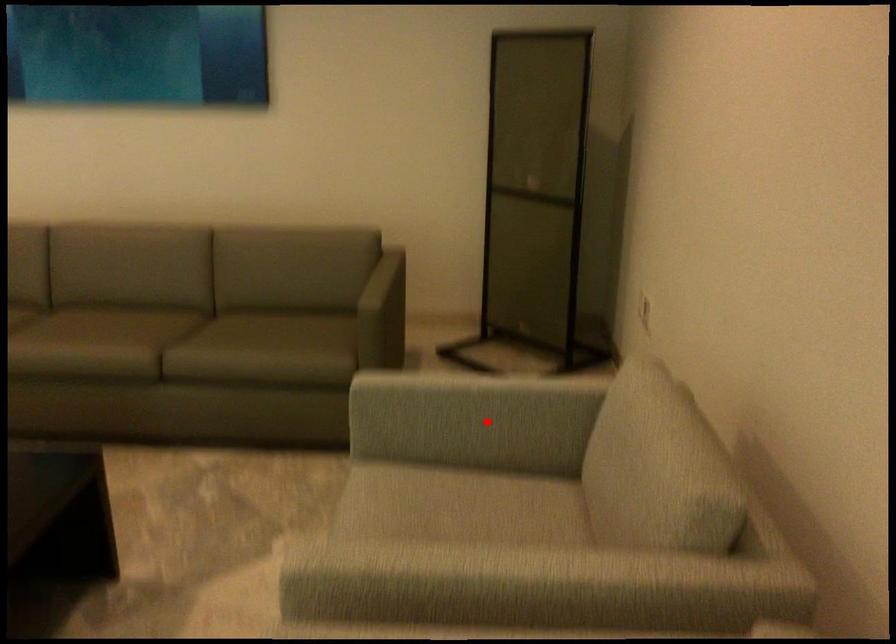
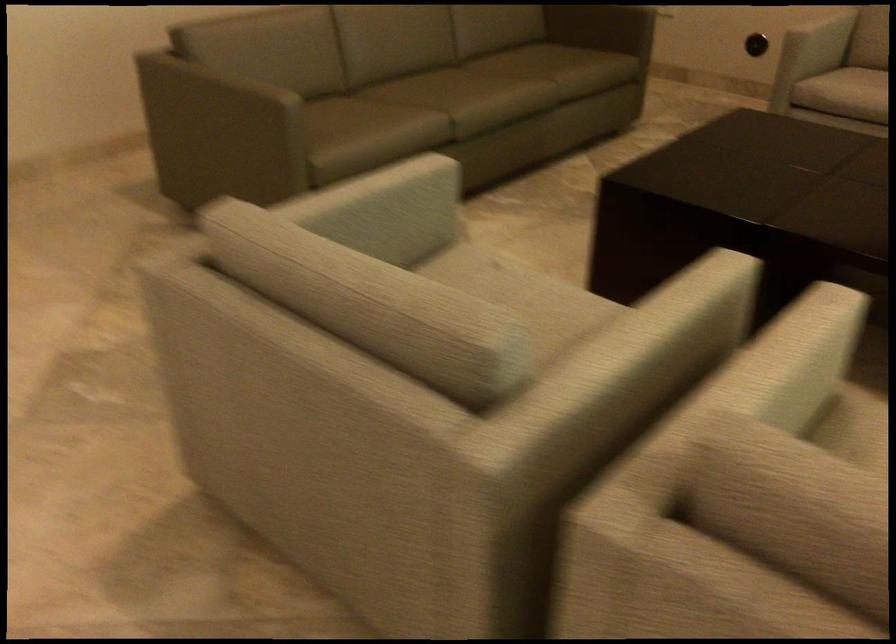
Question: I am providing you with two images of the same scene from different viewpoints. A red point is marked on the first image. Can you still see the location of the red point in image 2?

Choices:
 (A) Yes
 (B) No

Answer: (A)